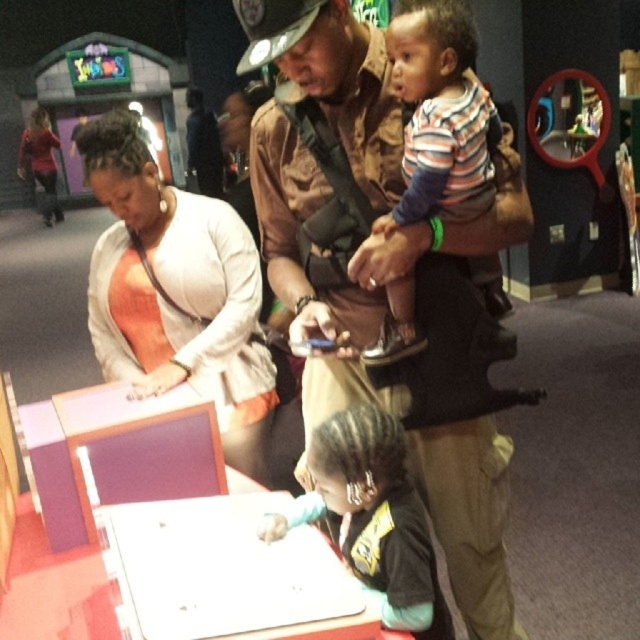
You are a photographer at the museum and want to take a photo of the brown leather jacket at center and the striped cotton shirt at upper center. Which object should you focus on first if you want to capture both in the same frame without moving the camera?

The brown leather jacket at center is positioned under the striped cotton shirt at upper center, so you should focus on the striped cotton shirt at upper center first as it is higher in the frame.

You are a photographer trying to capture a candid shot of the brown leather jacket at center and the striped cotton shirt at upper center. Since you want both subjects in the frame, which object should you position closer to the left side of your camera viewfinder to ensure they both fit?

To include both the brown leather jacket at center and the striped cotton shirt at upper center in the frame, position the brown leather jacket at center on the left side of the viewfinder since it is already to the left of the striped cotton shirt at upper center.

You are a museum staff member observing the scene. There are two shirts visible in the image. The orange fabric shirt at center and the striped cotton shirt at upper center. Which one is higher positioned?

The orange fabric shirt at center is taller than the striped cotton shirt at upper center, so the orange fabric shirt at center is higher positioned.